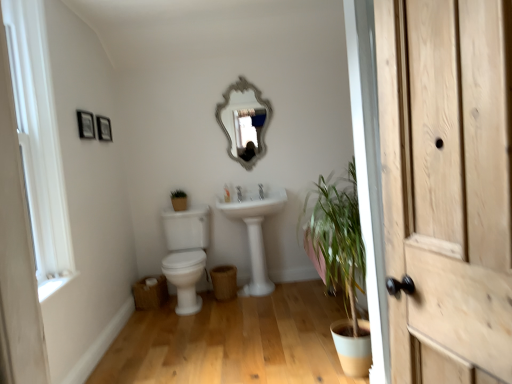
You are a GUI agent. You are given a task and a screenshot of the screen. Output one action in this format:
    pyautogui.click(x=<x>, y=<y>)
    Task: Click on the white glossy toilet at lower left
    
    Given the screenshot: What is the action you would take?
    pyautogui.click(x=232, y=341)

The width and height of the screenshot is (512, 384). What do you see at coordinates (232, 341) in the screenshot?
I see `white glossy toilet at lower left` at bounding box center [232, 341].

Find the location of `white glossy sink at center`. white glossy sink at center is located at coordinates (256, 236).

Measure the distance between white glossy sink at center and camera.

white glossy sink at center is 3.62 meters from camera.

Describe the element at coordinates (86, 124) in the screenshot. Image resolution: width=512 pixels, height=384 pixels. I see `wooden picture frame at upper left, positioned as the first picture frame in front-to-back order` at that location.

You are a GUI agent. You are given a task and a screenshot of the screen. Output one action in this format:
    pyautogui.click(x=<x>, y=<y>)
    Task: Click on the white glossy toilet at center-left
    Image resolution: width=512 pixels, height=384 pixels.
    Given the screenshot: What is the action you would take?
    pyautogui.click(x=186, y=254)

The image size is (512, 384). I want to click on silver/glass mirror at upper center, so click(x=243, y=121).

At what (x,y) coordinates should I click in order to perform the action: click on white painted wood window frame at left. Please return your answer as a coordinate pair (x, y). Image resolution: width=512 pixels, height=384 pixels. Looking at the image, I should click on (39, 143).

What do you see at coordinates (104, 128) in the screenshot?
I see `wooden picture frame at upper left, which is counted as the 2th picture frame, starting from the front` at bounding box center [104, 128].

Where is `light brown wood door at right`? The image size is (512, 384). light brown wood door at right is located at coordinates (447, 186).

From the picture: Which object is further away from the camera taking this photo, light brown wood door at right or white glossy toilet at center-left?

white glossy toilet at center-left is behind.

Considering the sizes of objects light brown wood door at right and white glossy toilet at center-left in the image provided, who is taller, light brown wood door at right or white glossy toilet at center-left?

Standing taller between the two is light brown wood door at right.

Can you confirm if light brown wood door at right is wider than white glossy toilet at center-left?

No.

Does white glossy sink at center appear on the right side of white painted wood window frame at left?

Indeed, white glossy sink at center is positioned on the right side of white painted wood window frame at left.

Locate an element on the screen. The height and width of the screenshot is (384, 512). sink below the white painted wood window frame at left (from the image's perspective) is located at coordinates (256, 236).

Considering the sizes of objects white glossy sink at center and white painted wood window frame at left in the image provided, who is wider, white glossy sink at center or white painted wood window frame at left?

white glossy sink at center.

Would you say white ceramic tap at center is outside white painted wood window frame at left?

Indeed, white ceramic tap at center is completely outside white painted wood window frame at left.

Could you tell me if white ceramic tap at center is facing white painted wood window frame at left?

No, white ceramic tap at center is not facing towards white painted wood window frame at left.

Considering the sizes of white ceramic tap at center and white painted wood window frame at left in the image, is white ceramic tap at center taller or shorter than white painted wood window frame at left?

Clearly, white ceramic tap at center is shorter compared to white painted wood window frame at left.

Consider the image. Is white ceramic tap at center next to white painted wood window frame at left and touching it?

No.

Is white painted wood window frame at left turned away from white ceramic tap at center?

white painted wood window frame at left does not have its back to white ceramic tap at center.

Does point (45, 102) lie in front of point (259, 188)?

Yes, it is.

Considering the relative sizes of white painted wood window frame at left and white ceramic tap at center in the image provided, is white painted wood window frame at left shorter than white ceramic tap at center?

No, white painted wood window frame at left is not shorter than white ceramic tap at center.

What's the angular difference between white painted wood window frame at left and white ceramic tap at center's facing directions?

92.9 degrees separate the facing orientations of white painted wood window frame at left and white ceramic tap at center.

Which is correct: white glossy sink at center is inside light brown wood door at right, or outside of it?

The correct answer is: outside.

From the image's perspective, which one is positioned higher, white glossy sink at center or light brown wood door at right?

light brown wood door at right appears higher in the image.

You are a GUI agent. You are given a task and a screenshot of the screen. Output one action in this format:
    pyautogui.click(x=<x>, y=<y>)
    Task: Click on the sink that appears below the light brown wood door at right (from a real-world perspective)
    This screenshot has height=384, width=512.
    Given the screenshot: What is the action you would take?
    pyautogui.click(x=256, y=236)

From a real-world perspective, which object rests below the other?

white glossy sink at center is physically lower.

Which object is positioned more to the right, white painted wood window frame at left or white glossy toilet at center-left?

From the viewer's perspective, white glossy toilet at center-left appears more on the right side.

Is white painted wood window frame at left situated inside white glossy toilet at center-left or outside?

white painted wood window frame at left is not enclosed by white glossy toilet at center-left.

Can you tell me how much white painted wood window frame at left and white glossy toilet at center-left differ in facing direction?

There is a 92-degree angle between the facing directions of white painted wood window frame at left and white glossy toilet at center-left.

Considering the sizes of white painted wood window frame at left and white glossy toilet at center-left in the image, is white painted wood window frame at left taller or shorter than white glossy toilet at center-left?

Considering their sizes, white painted wood window frame at left has more height than white glossy toilet at center-left.

Where is `tap below the wooden picture frame at upper left, positioned as the first picture frame in front-to-back order (from a real-world perspective)`? tap below the wooden picture frame at upper left, positioned as the first picture frame in front-to-back order (from a real-world perspective) is located at coordinates (261, 191).

From a real-world perspective, is white ceramic tap at center under wooden picture frame at upper left, positioned as the first picture frame in front-to-back order?

Indeed, from a real-world perspective, white ceramic tap at center is positioned beneath wooden picture frame at upper left, positioned as the first picture frame in front-to-back order.

Does white ceramic tap at center have a lesser height compared to wooden picture frame at upper left, arranged as the 2th picture frame when viewed from the back?

Indeed, white ceramic tap at center has a lesser height compared to wooden picture frame at upper left, arranged as the 2th picture frame when viewed from the back.

Is white ceramic tap at center to the left or to the right of wooden picture frame at upper left, arranged as the 2th picture frame when viewed from the back, in the image?

white ceramic tap at center is to the right of wooden picture frame at upper left, arranged as the 2th picture frame when viewed from the back.

Identify the location of door above the white glossy toilet at center-left (from a real-world perspective). This screenshot has height=384, width=512. (447, 186).

I want to click on sink below the white painted wood window frame at left (from a real-world perspective), so click(x=256, y=236).

Looking at the image, which one is located closer to white glossy sink at center, wooden picture frame at upper left, arranged as the 2th picture frame when viewed from the back, or wooden picture frame at upper left, the 1th picture frame from the back?

Based on the image, wooden picture frame at upper left, the 1th picture frame from the back, appears to be nearer to white glossy sink at center.

Considering their positions, is silver/glass mirror at upper center positioned further to white glossy toilet at center-left than light brown wood door at right?

light brown wood door at right.

Based on their spatial positions, is wooden picture frame at upper left, positioned as the first picture frame in front-to-back order, or white glossy toilet at lower left further from silver/glass mirror at upper center?

Based on the image, white glossy toilet at lower left appears to be further to silver/glass mirror at upper center.

Estimate the real-world distances between objects in this image. Which object is closer to white glossy toilet at center-left, wooden picture frame at upper left, positioned as the first picture frame in front-to-back order, or white glossy toilet at lower left?

white glossy toilet at lower left is closer to white glossy toilet at center-left.

Looking at the image, which one is located further to white painted wood window frame at left, white ceramic tap at center or white glossy toilet at lower left?

The object further to white painted wood window frame at left is white ceramic tap at center.

From the image, which object appears to be farther from white glossy toilet at center-left, silver/glass mirror at upper center or white glossy sink at center?

silver/glass mirror at upper center lies further to white glossy toilet at center-left than the other object.

Based on their spatial positions, is white painted wood window frame at left or white glossy sink at center closer to white glossy toilet at lower left?

white glossy sink at center.

Based on their spatial positions, is light brown wood door at right or white painted wood window frame at left further from white glossy toilet at lower left?

light brown wood door at right.

This screenshot has height=384, width=512. In order to click on toilet located between white painted wood window frame at left and wooden picture frame at upper left, which is counted as the 2th picture frame, starting from the front, in the depth direction in this screenshot , I will do `click(186, 254)`.

Image resolution: width=512 pixels, height=384 pixels. I want to click on window frame between light brown wood door at right and wooden picture frame at upper left, arranged as the 2th picture frame when viewed from the back, in the front-back direction, so click(x=39, y=143).

Where is `picture frame between wooden picture frame at upper left, which is counted as the 2th picture frame, starting from the front, and white glossy toilet at center-left, in the vertical direction`? The width and height of the screenshot is (512, 384). picture frame between wooden picture frame at upper left, which is counted as the 2th picture frame, starting from the front, and white glossy toilet at center-left, in the vertical direction is located at coordinates click(x=86, y=124).

You are a GUI agent. You are given a task and a screenshot of the screen. Output one action in this format:
    pyautogui.click(x=<x>, y=<y>)
    Task: Click on the sink between white painted wood window frame at left and silver/glass mirror at upper center in the front-back direction
    This screenshot has height=384, width=512.
    Given the screenshot: What is the action you would take?
    pyautogui.click(x=256, y=236)